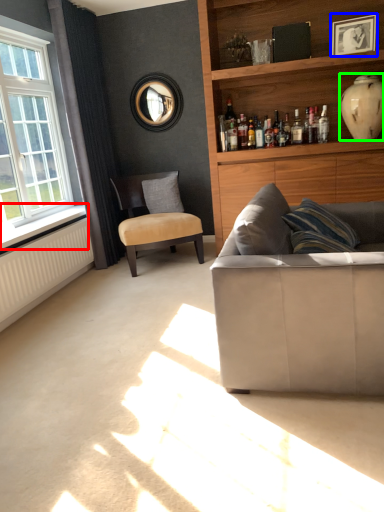
Question: Which object is the closest to the window sill (highlighted by a red box)? Choose among these: picture frame (highlighted by a blue box) or vase (highlighted by a green box).

Choices:
 (A) picture frame
 (B) vase

Answer: (B)